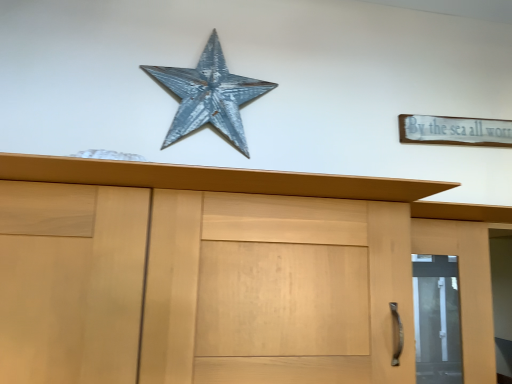
Question: Does rusty metal star at upper center appear on the left side of white wood sign at upper right?

Choices:
 (A) no
 (B) yes

Answer: (B)

Question: Is rusty metal star at upper center far away from white wood sign at upper right?

Choices:
 (A) yes
 (B) no

Answer: (B)

Question: From a real-world perspective, is rusty metal star at upper center over white wood sign at upper right?

Choices:
 (A) no
 (B) yes

Answer: (B)

Question: Considering the relative sizes of rusty metal star at upper center and white wood sign at upper right in the image provided, is rusty metal star at upper center bigger than white wood sign at upper right?

Choices:
 (A) yes
 (B) no

Answer: (A)

Question: Does rusty metal star at upper center have a lesser width compared to white wood sign at upper right?

Choices:
 (A) no
 (B) yes

Answer: (A)

Question: From the image's perspective, is rusty metal star at upper center over white wood sign at upper right?

Choices:
 (A) no
 (B) yes

Answer: (B)

Question: Does matte wood door at right have a smaller size compared to white wood sign at upper right?

Choices:
 (A) no
 (B) yes

Answer: (A)

Question: From a real-world perspective, is matte wood door at right on top of white wood sign at upper right?

Choices:
 (A) no
 (B) yes

Answer: (A)

Question: Does matte wood door at right appear on the left side of white wood sign at upper right?

Choices:
 (A) no
 (B) yes

Answer: (A)

Question: Is matte wood door at right with white wood sign at upper right?

Choices:
 (A) no
 (B) yes

Answer: (A)

Question: Is matte wood door at right taller than white wood sign at upper right?

Choices:
 (A) yes
 (B) no

Answer: (A)

Question: From the image's perspective, is matte wood door at right above white wood sign at upper right?

Choices:
 (A) yes
 (B) no

Answer: (B)

Question: Does white wood sign at upper right have a greater height compared to matte wood door at right?

Choices:
 (A) yes
 (B) no

Answer: (B)